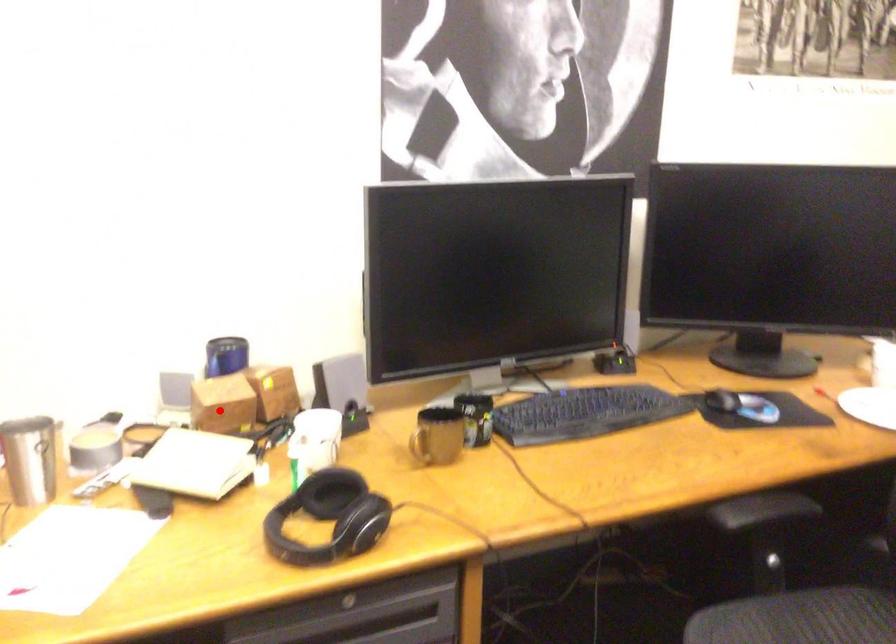
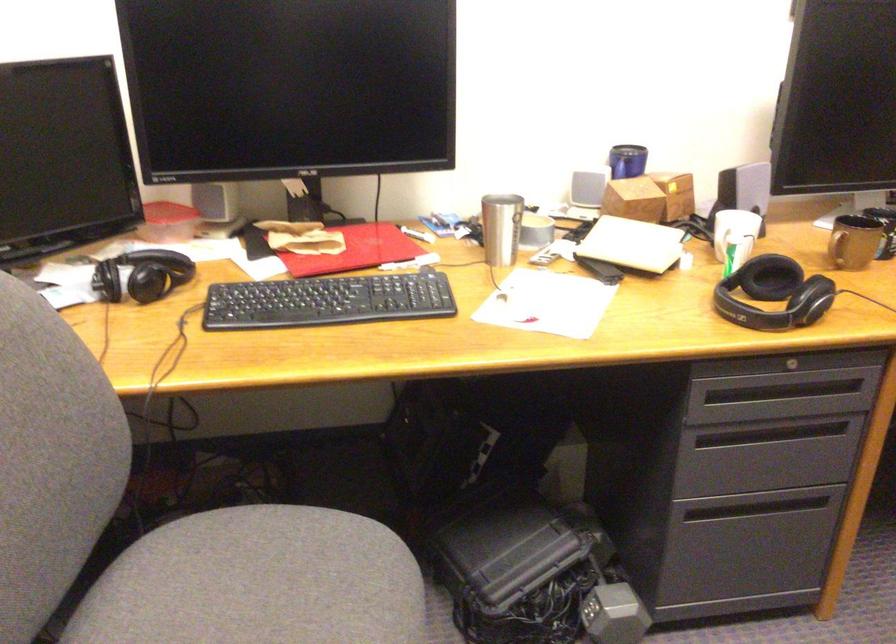
Where in the second image is the point corresponding to the highlighted location from the first image?

(633, 200)